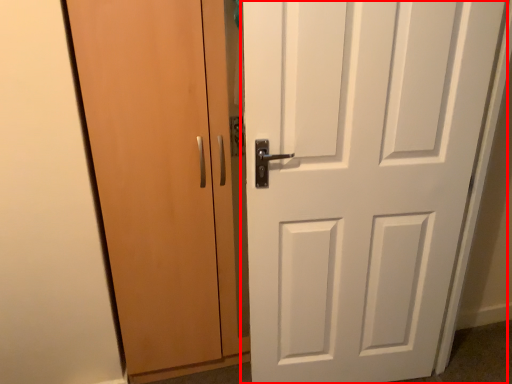
Question: From the image's perspective, what is the correct spatial positioning of door (annotated by the red box) in reference to door?

Choices:
 (A) below
 (B) above

Answer: (A)